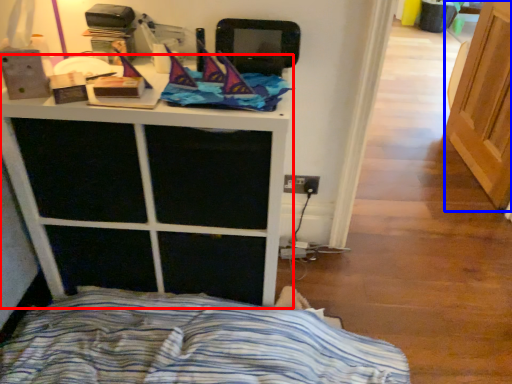
Question: Among these objects, which one is nearest to the camera, furniture (highlighted by a red box) or screen door (highlighted by a blue box)?

Choices:
 (A) furniture
 (B) screen door

Answer: (A)